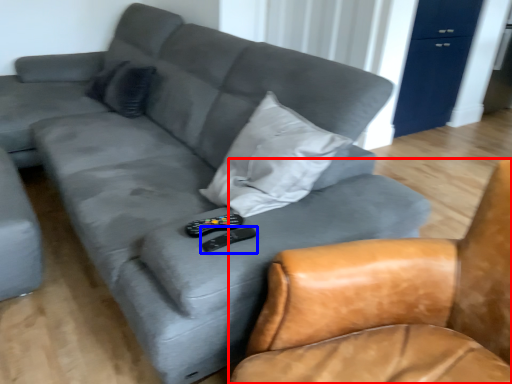
Question: Which object appears closest to the camera in this image, chair (highlighted by a red box) or remote (highlighted by a blue box)?

Choices:
 (A) chair
 (B) remote

Answer: (A)